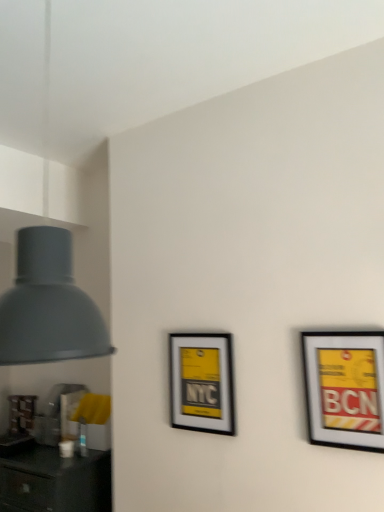
Question: Is the position of matte gray lampshade at left more distant than that of matte black picture frame at right, which is the first picture frame in right-to-left order?

Choices:
 (A) yes
 (B) no

Answer: (B)

Question: Can you see matte gray lampshade at left touching matte black picture frame at right, which is the first picture frame in right-to-left order?

Choices:
 (A) no
 (B) yes

Answer: (A)

Question: Is matte gray lampshade at left shorter than matte black picture frame at right, acting as the first picture frame starting from the front?

Choices:
 (A) no
 (B) yes

Answer: (A)

Question: Is the position of matte gray lampshade at left less distant than that of matte black picture frame at right, acting as the first picture frame starting from the front?

Choices:
 (A) yes
 (B) no

Answer: (A)

Question: Is matte gray lampshade at left turned away from matte black picture frame at right, acting as the first picture frame starting from the front?

Choices:
 (A) yes
 (B) no

Answer: (B)

Question: From the image's perspective, is matte black picture frame at right, acting as the first picture frame starting from the front, positioned above or below matte black picture frame at center, which ranks as the 1th picture frame in left-to-right order?

Choices:
 (A) above
 (B) below

Answer: (A)

Question: Is matte black picture frame at right, acting as the second picture frame starting from the back, to the left or to the right of matte black picture frame at center, which ranks as the 1th picture frame in left-to-right order, in the image?

Choices:
 (A) left
 (B) right

Answer: (B)

Question: Is matte black picture frame at right, which is the first picture frame in right-to-left order, bigger or smaller than matte black picture frame at center, which ranks as the 1th picture frame in left-to-right order?

Choices:
 (A) big
 (B) small

Answer: (B)

Question: Is point [x=340, y=425] positioned closer to the camera than point [x=200, y=346]?

Choices:
 (A) closer
 (B) farther

Answer: (A)

Question: From a real-world perspective, is matte gray lampshade at left physically located above or below matte black picture frame at right, acting as the second picture frame starting from the back?

Choices:
 (A) above
 (B) below

Answer: (A)

Question: Is point (24, 330) positioned closer to the camera than point (311, 362)?

Choices:
 (A) closer
 (B) farther

Answer: (A)

Question: Considering the relative positions of matte gray lampshade at left and matte black picture frame at right, which is the first picture frame in right-to-left order, in the image provided, is matte gray lampshade at left to the left or to the right of matte black picture frame at right, which is the first picture frame in right-to-left order,?

Choices:
 (A) right
 (B) left

Answer: (B)

Question: From the image's perspective, relative to matte black picture frame at right, acting as the first picture frame starting from the front, is matte gray lampshade at left above or below?

Choices:
 (A) above
 (B) below

Answer: (A)

Question: Choose the correct answer: Is matte black picture frame at center, the second picture frame positioned from the right, inside matte black picture frame at right, acting as the first picture frame starting from the front, or outside it?

Choices:
 (A) outside
 (B) inside

Answer: (A)

Question: Is matte black picture frame at center, which ranks as the first picture frame in back-to-front order, taller or shorter than matte black picture frame at right, the 2th picture frame in the left-to-right sequence?

Choices:
 (A) short
 (B) tall

Answer: (A)